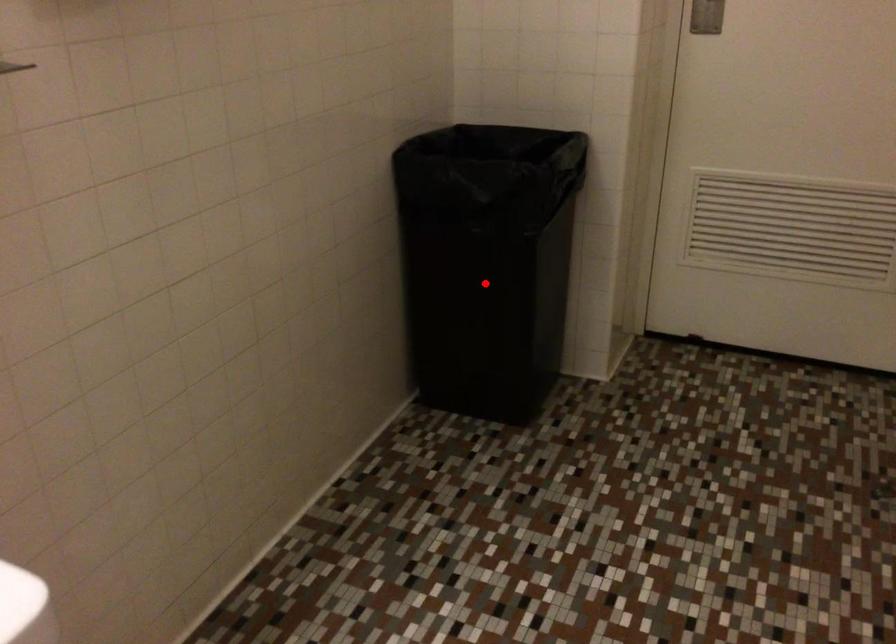
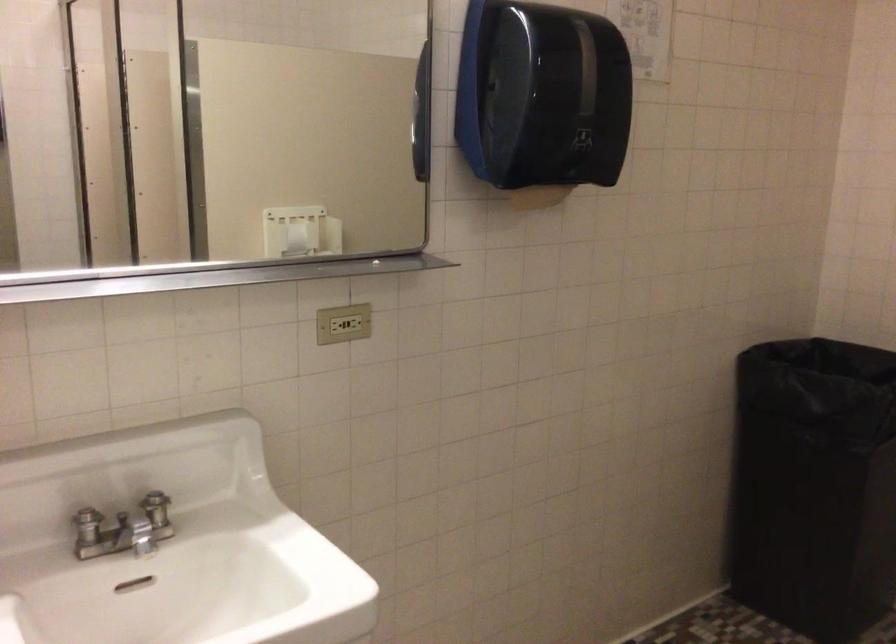
In the second image, find the point that corresponds to the highlighted location in the first image.

(814, 486)